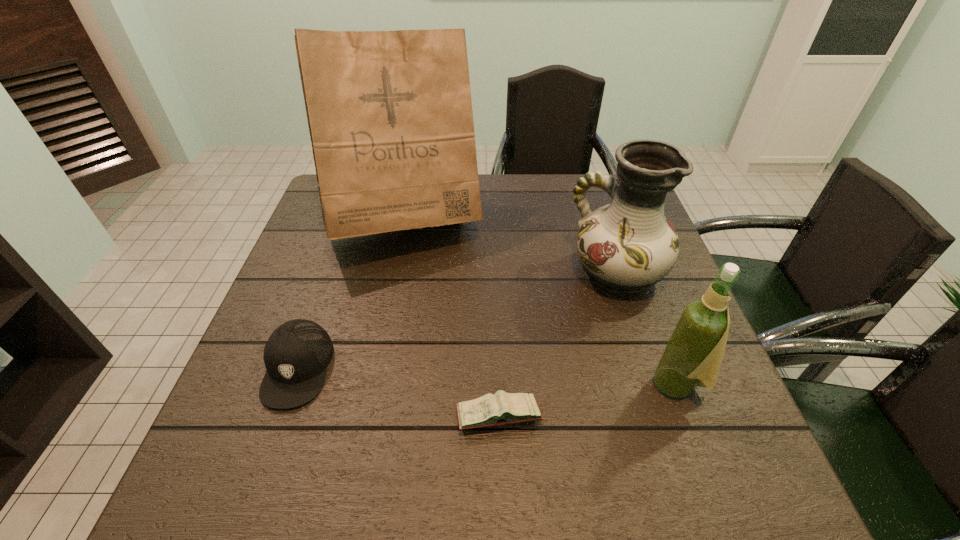
The image size is (960, 540). I want to click on the tallest object, so click(390, 117).

In order to click on vase in this screenshot , I will do `click(628, 245)`.

Where is `wine bottle`? This screenshot has width=960, height=540. wine bottle is located at coordinates (693, 355).

At what (x,y) coordinates should I click in order to perform the action: click on cap. Please return your answer as a coordinate pair (x, y). Looking at the image, I should click on (296, 355).

Find the location of `diary`. diary is located at coordinates (502, 408).

This screenshot has width=960, height=540. I want to click on vacant space located 0.050m on the back of the tallest object, so click(x=417, y=174).

You are a GUI agent. You are given a task and a screenshot of the screen. Output one action in this format:
    pyautogui.click(x=<x>, y=<y>)
    Task: Click on the vacant area situated on the left of the vase
    The height and width of the screenshot is (540, 960).
    Given the screenshot: What is the action you would take?
    pyautogui.click(x=448, y=272)

Find the location of a particular element. This screenshot has width=960, height=540. vacant space situated on the front-facing side of the wine bottle is located at coordinates (546, 384).

Find the location of a particular element. This screenshot has width=960, height=540. free space located 0.100m on the front-facing side of the wine bottle is located at coordinates (602, 384).

I want to click on free point located on the front-facing side of the wine bottle, so click(616, 384).